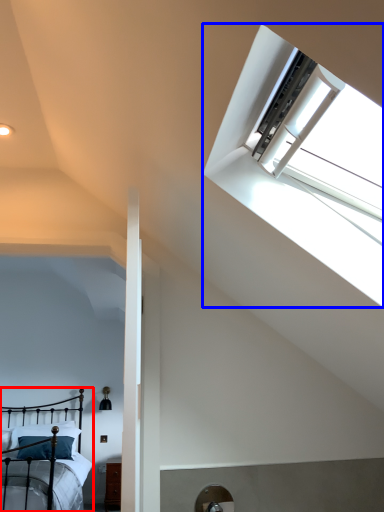
Question: Which point is closer to the camera, bed (highlighted by a red box) or window (highlighted by a blue box)?

Choices:
 (A) bed
 (B) window

Answer: (B)